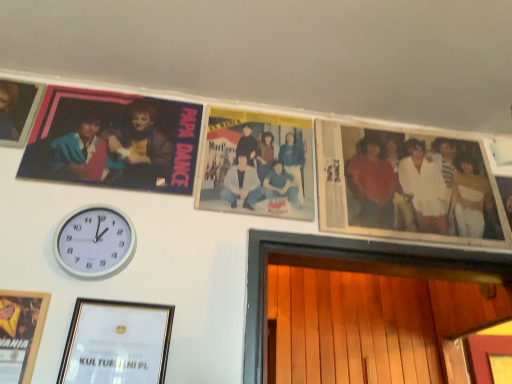
Question: From the image's perspective, is matte plastic photo frame at upper left, the 2th picture frame when ordered from top to bottom, positioned above or below white cotton shirt at right?

Choices:
 (A) above
 (B) below

Answer: (A)

Question: From a real-world perspective, is matte plastic photo frame at upper left, which is counted as the 3th picture frame, starting from the bottom, physically located above or below white cotton shirt at right?

Choices:
 (A) below
 (B) above

Answer: (B)

Question: Which is farther from the matte plastic photo frame at upper left, which is counted as the 3th picture frame, starting from the bottom?

Choices:
 (A) white cotton shirt at right
 (B) wooden picture frame at lower left, arranged as the 3th picture frame when viewed from the top
 (C) white plastic wall clock at lower left
 (D) gold-framed certificate at lower left, the 1th picture frame ordered from the bottom
 (E) matte black photo frame at upper left, positioned as the first picture frame in top-to-bottom order

Answer: (A)

Question: Which object is the farthest from the gold-framed certificate at lower left, the 1th picture frame ordered from the bottom?

Choices:
 (A) matte plastic photo frame at upper left, which is counted as the 3th picture frame, starting from the bottom
 (B) white cotton shirt at right
 (C) matte black photo frame at upper left, which is the fourth picture frame from bottom to top
 (D) white plastic wall clock at lower left
 (E) wooden picture frame at lower left, arranged as the 3th picture frame when viewed from the top

Answer: (B)